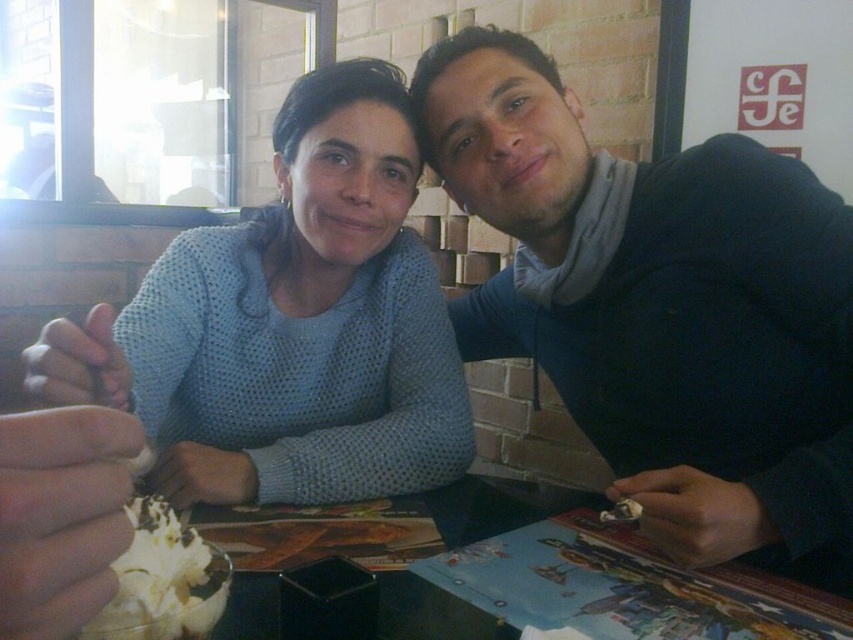
You are a photographer trying to capture the light blue knitted sweater at upper left and the dark blue hoodie on the right. Based on their positions, which object is closer to the center of the image?

The light blue knitted sweater at upper left is located at point (289, 324), which is closer to the center of the image compared to the dark blue hoodie on the right.

You are a customer at the cafe and want to grab the whipped cream at lower left without moving your chair. Can you reach it from where you are sitting, considering the light blue knitted sweater at upper left is blocking your path?

The light blue knitted sweater at upper left is to the left of whipped cream at lower left, so it is blocking your path. You might need to adjust your position to reach the whipped cream at lower left.

You are a photographer trying to capture a closeup of the whipped cream at lower left without including the light blue knitted sweater at upper left in the frame. Given their sizes, is this possible?

The light blue knitted sweater at upper left is larger in size than whipped cream at lower left, so it might be challenging to exclude the sweater from the frame if the whipped cream is positioned near it. Adjust your angle or zoom to focus solely on the whipped cream at lower left.